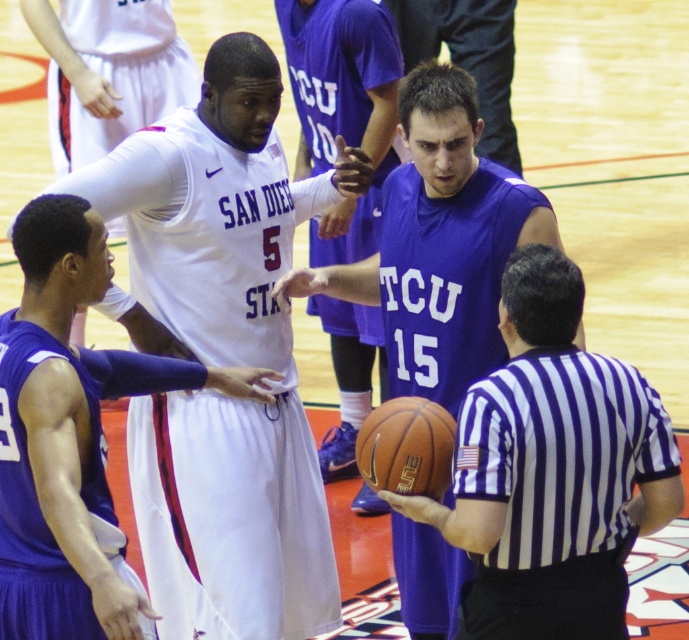
Question: Is matte purple jersey at center positioned before matte white jersey at center?

Choices:
 (A) yes
 (B) no

Answer: (B)

Question: Which object is closer to the camera taking this photo?

Choices:
 (A) white jersey at center
 (B) matte purple jersey at center
 (C) purple jersey at center

Answer: (B)

Question: Which point is closer to the camera?

Choices:
 (A) (339, 51)
 (B) (83, 616)
 (C) (387, 406)

Answer: (B)

Question: Is matte white jersey at center to the left of rubber textured basketball at center from the viewer's perspective?

Choices:
 (A) yes
 (B) no

Answer: (A)

Question: Can you confirm if matte purple jersey at center is wider than white jersey at center?

Choices:
 (A) no
 (B) yes

Answer: (B)

Question: Which point appears farthest from the camera in this image?

Choices:
 (A) (435, 166)
 (B) (71, 310)

Answer: (A)